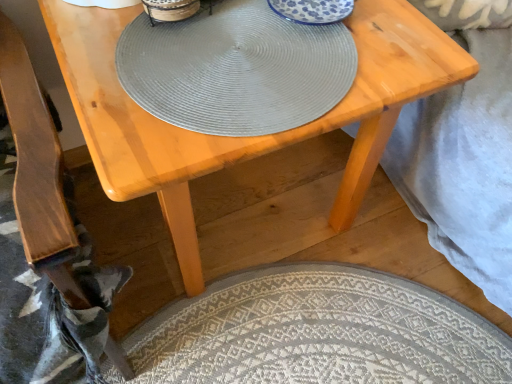
Image resolution: width=512 pixels, height=384 pixels. Find the location of `vacant area that lies to the right of matte gray placemat at center`. vacant area that lies to the right of matte gray placemat at center is located at coordinates (262, 38).